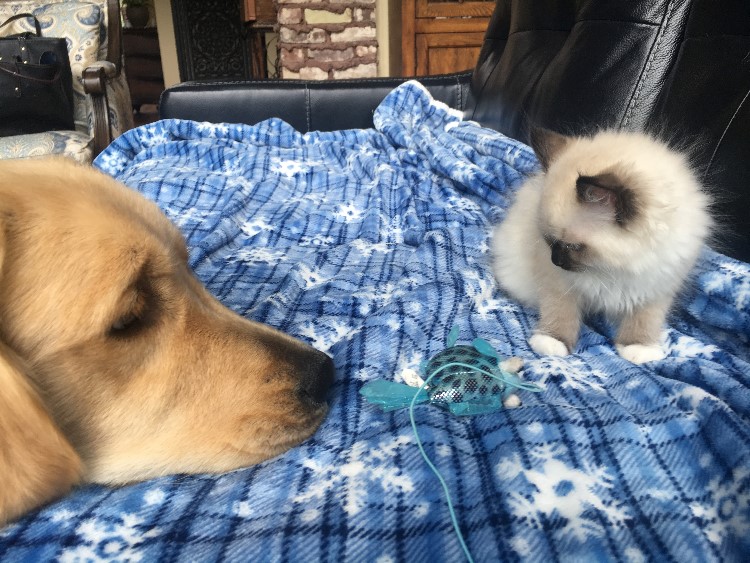
Find the location of a particular element. This screenshot has height=563, width=750. blanket is located at coordinates (333, 252).